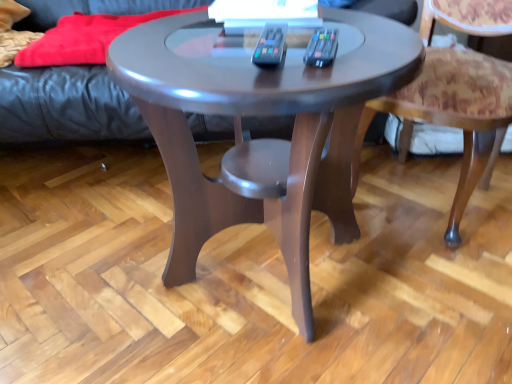
Identify the location of free region under glossy wood coffee table at center (from a real-world perspective). This screenshot has width=512, height=384. (257, 279).